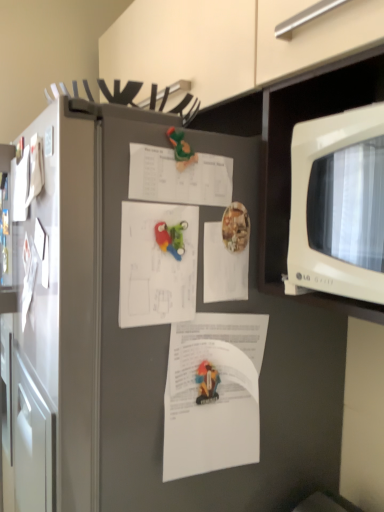
Question: Which direction should I rotate to look at white paper at center, which is the 1th document from bottom to top, — up or down?

Choices:
 (A) down
 (B) up

Answer: (A)

Question: From a real-world perspective, is white glossy microwave at right below white paper at center, positioned as the 3th document in top-to-bottom order?

Choices:
 (A) no
 (B) yes

Answer: (A)

Question: Is white glossy microwave at right far from white paper at center, acting as the 2th document starting from the bottom?

Choices:
 (A) yes
 (B) no

Answer: (B)

Question: Does white glossy microwave at right come in front of white paper at center, acting as the 2th document starting from the bottom?

Choices:
 (A) no
 (B) yes

Answer: (B)

Question: Is white glossy microwave at right outside of white paper at center, acting as the 2th document starting from the bottom?

Choices:
 (A) no
 (B) yes

Answer: (B)

Question: Considering the relative sizes of white glossy microwave at right and white paper at center, positioned as the 3th document in top-to-bottom order, in the image provided, is white glossy microwave at right thinner than white paper at center, positioned as the 3th document in top-to-bottom order,?

Choices:
 (A) yes
 (B) no

Answer: (B)

Question: Is the position of white glossy microwave at right more distant than that of white paper at center, acting as the 2th document starting from the bottom?

Choices:
 (A) no
 (B) yes

Answer: (A)

Question: Does white paper at center, which is the 3th document in bottom-to-top order, come behind white paper at upper center, which is the fourth document from bottom to top?

Choices:
 (A) yes
 (B) no

Answer: (A)

Question: Does white paper at center, which is the 3th document in bottom-to-top order, have a greater width compared to white paper at upper center, which is the fourth document from bottom to top?

Choices:
 (A) no
 (B) yes

Answer: (A)

Question: Considering the relative sizes of white paper at center, which is the 3th document in bottom-to-top order, and white paper at upper center, positioned as the 1th document in top-to-bottom order, in the image provided, is white paper at center, which is the 3th document in bottom-to-top order, taller than white paper at upper center, positioned as the 1th document in top-to-bottom order,?

Choices:
 (A) yes
 (B) no

Answer: (A)

Question: Is white paper at center, which is the 3th document in bottom-to-top order, at the right side of white paper at upper center, positioned as the 1th document in top-to-bottom order?

Choices:
 (A) yes
 (B) no

Answer: (A)

Question: Is white paper at center, the second document in the top-to-bottom sequence, placed right next to white paper at upper center, which is the fourth document from bottom to top?

Choices:
 (A) yes
 (B) no

Answer: (B)

Question: Considering the relative sizes of white paper at center, the second document in the top-to-bottom sequence, and white paper at upper center, positioned as the 1th document in top-to-bottom order, in the image provided, is white paper at center, the second document in the top-to-bottom sequence, thinner than white paper at upper center, positioned as the 1th document in top-to-bottom order,?

Choices:
 (A) no
 (B) yes

Answer: (B)

Question: Is rubberized plastic toy at center, which ranks as the second toy in top-to-bottom order, at the right side of white glossy microwave at right?

Choices:
 (A) no
 (B) yes

Answer: (A)